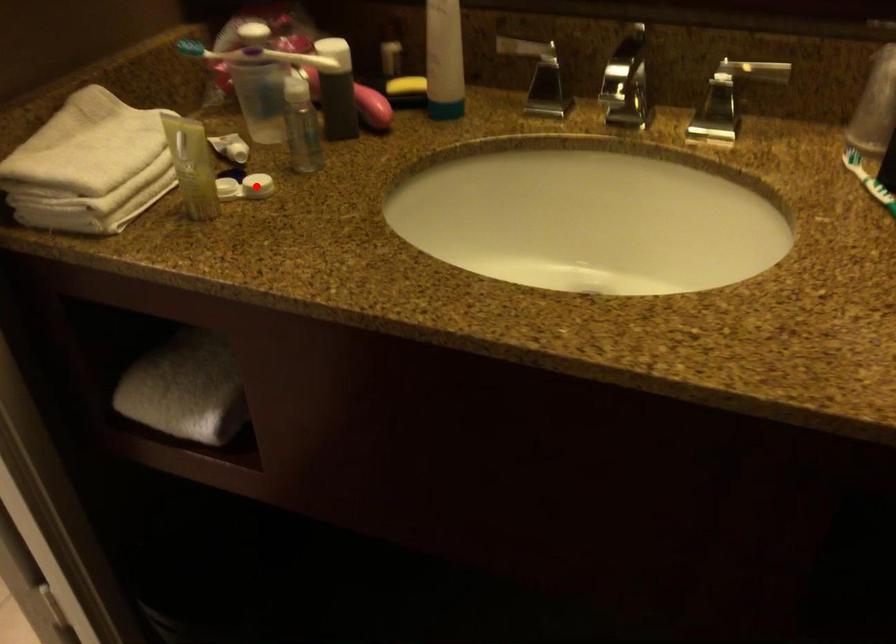
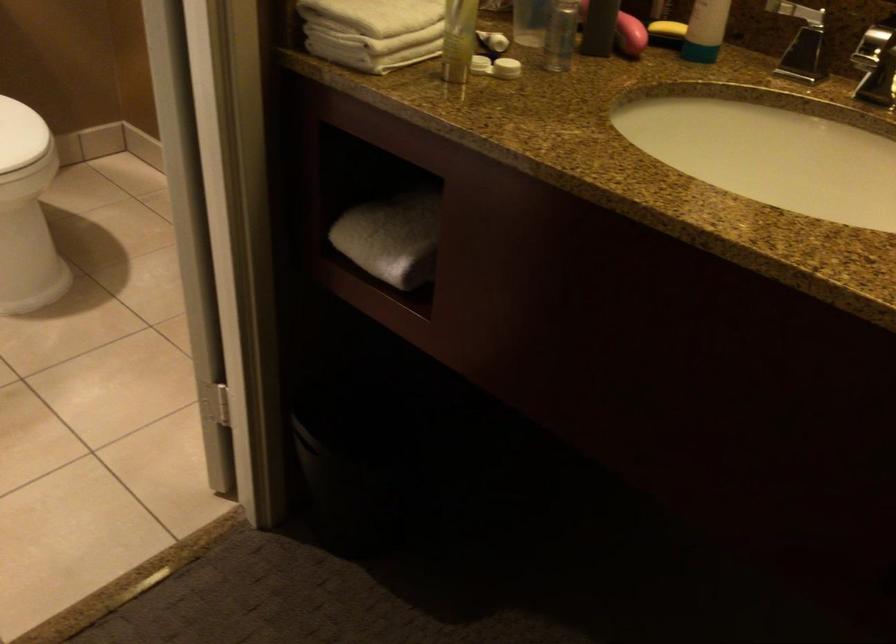
Question: I am providing you with two images of the same scene from different viewpoints. In image1, a red point is highlighted. Considering the same 3D point in image2, which of the following is correct?

Choices:
 (A) It is closer
 (B) It is farther

Answer: (B)